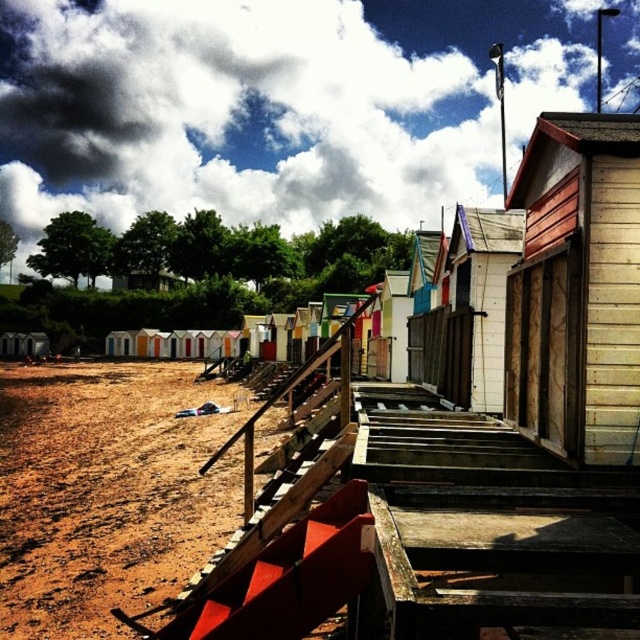
You are standing at the beach and see two points marked on the sand. The first point is at position point [124,467] and the second point is at position point [627,420]. Which point is closer to the wooden steps leading up to the red roofed hut?

Point [124,467] is behind point [627,420], so the point closer to the wooden steps would be point [627,420] since it is in front.

You are standing at the bottom of the wooden steps leading to the wooden cabin at right. You want to place a small potted plant on the brown sandy dirt at lower left. Can you see the potted plant from the top of the wooden steps?

The brown sandy dirt at lower left is not as tall as wooden cabin at right, so yes, you can see the potted plant placed on the brown sandy dirt at lower left from the top of the wooden steps.

You are standing on the brown sandy dirt at lower left and want to reach the wooden cabin at right. Which direction should you move to get closer to the cabin?

You should move away from the viewer since the brown sandy dirt at lower left is closer to you than the wooden cabin at right.